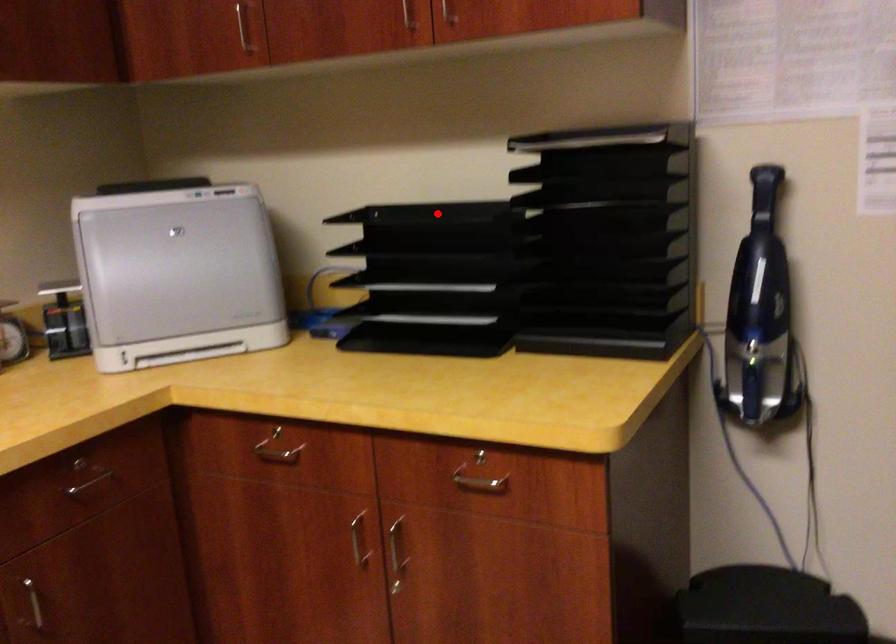
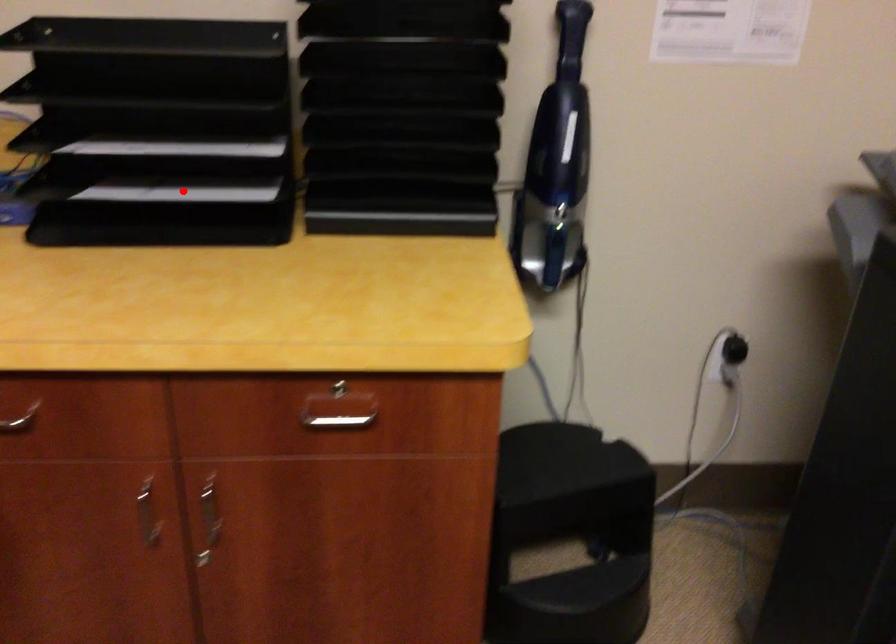
I am providing you with two images of the same scene from different viewpoints. A red point is marked on the first image and another point is marked on the second image. Does the point marked in image1 correspond to the same location as the one in image2?

No